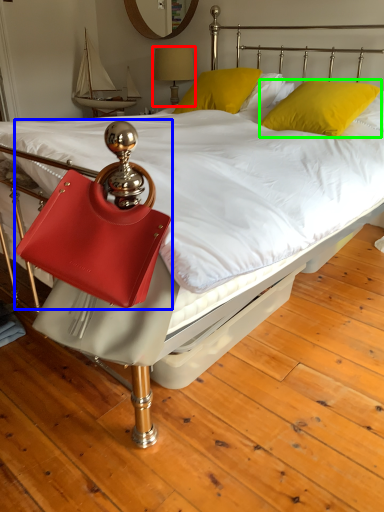
Question: Which is nearer to the bedside lamp (highlighted by a red box)? handbag (highlighted by a blue box) or pillow (highlighted by a green box).

Choices:
 (A) handbag
 (B) pillow

Answer: (B)